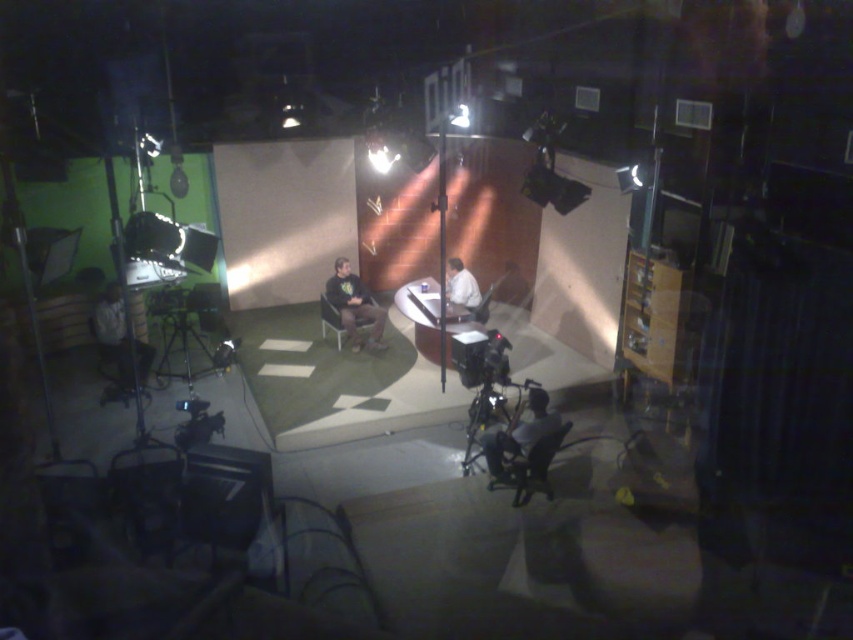
Looking at this image, you are standing in the TV studio and want to sit down. There is a point at coordinates (x=119, y=340). What object is located at that point?

The point at coordinates (x=119, y=340) corresponds to the dark gray fabric chair at lower left.

You are a technician in the studio and need to adjust two points on the set. The points are located at coordinates point (x=132, y=385) and point (x=457, y=282). Which point is closer to you?

Point (x=132, y=385) is closer to the viewer than point (x=457, y=282).